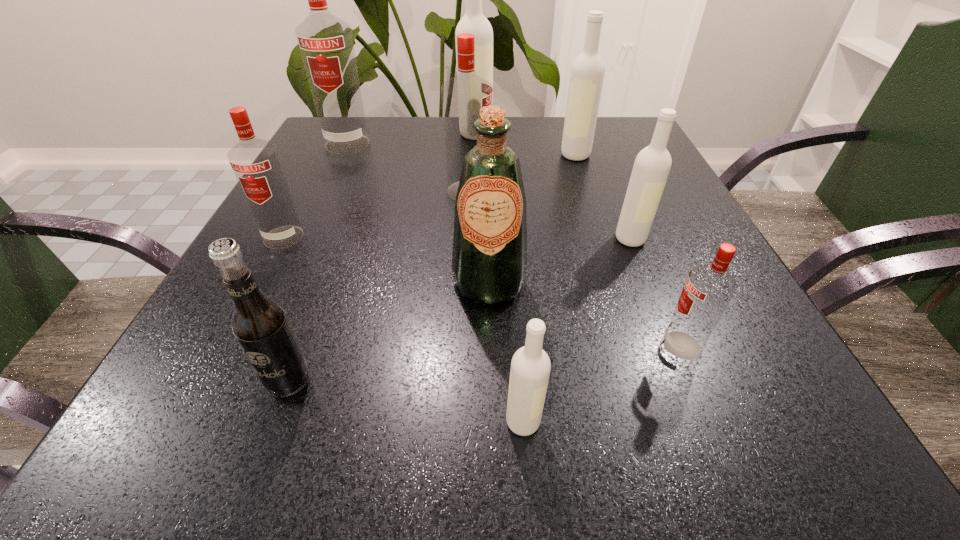
Locate an element on the screen. The height and width of the screenshot is (540, 960). free space located on the front of the second nearest white vodka is located at coordinates (651, 287).

In order to click on vacant region located 0.320m on the front label of the third biggest red vodka in this screenshot , I will do `click(191, 413)`.

Find the location of a particular element. This screenshot has height=540, width=960. vacant area situated on the front label of the rightmost red vodka is located at coordinates (452, 346).

Identify the location of vacant space situated 0.250m on the front label of the rightmost red vodka. The height and width of the screenshot is (540, 960). (487, 346).

You are a GUI agent. You are given a task and a screenshot of the screen. Output one action in this format:
    pyautogui.click(x=<x>, y=<y>)
    Task: Click on the vacant region located 0.060m on the front label of the rightmost red vodka
    Image resolution: width=960 pixels, height=540 pixels.
    Given the screenshot: What is the action you would take?
    pyautogui.click(x=620, y=346)

Where is `vacant space situated on the right of the nearest vodka`? Image resolution: width=960 pixels, height=540 pixels. vacant space situated on the right of the nearest vodka is located at coordinates (744, 422).

Identify the location of root beer present at the near edge. This screenshot has height=540, width=960. click(260, 325).

Locate an element on the screen. This screenshot has height=540, width=960. vodka that is at the near edge is located at coordinates 530,367.

At what (x,y) coordinates should I click in order to perform the action: click on root beer located in the left edge section of the desktop. Please return your answer as a coordinate pair (x, y). Looking at the image, I should click on pos(260,325).

Identify the location of object present at the far left corner. (325, 41).